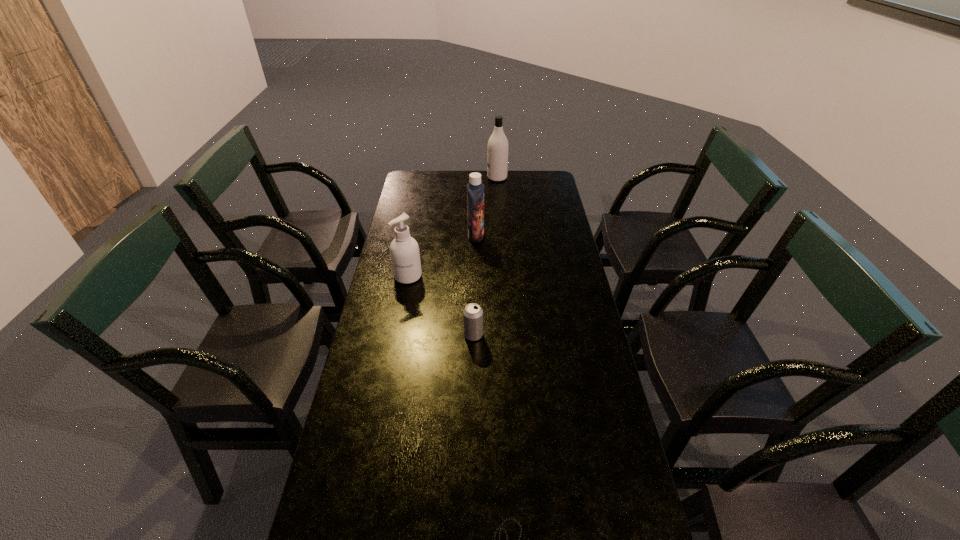
Identify the location of vacant space at the far right corner of the desktop. (530, 173).

Where is `vacant area that lies between the right shampoo and the fourth tallest object`? vacant area that lies between the right shampoo and the fourth tallest object is located at coordinates point(485,256).

Find the location of a particular element. This screenshot has width=960, height=540. vacant space in between the second farthest object and the cleansing agent is located at coordinates (442, 256).

Where is `unoccupied position between the farther shampoo and the beer can`? This screenshot has height=540, width=960. unoccupied position between the farther shampoo and the beer can is located at coordinates (485, 256).

Identify the location of vacant area that lies between the nearer shampoo and the farther shampoo. This screenshot has width=960, height=540. (487, 207).

You are a GUI agent. You are given a task and a screenshot of the screen. Output one action in this format:
    pyautogui.click(x=<x>, y=<y>)
    Task: Click on the vacant space that is in between the second shortest object and the nearer shampoo
    
    Given the screenshot: What is the action you would take?
    pyautogui.click(x=474, y=286)

Where is `empty space between the cleansing agent and the left shampoo`? Image resolution: width=960 pixels, height=540 pixels. empty space between the cleansing agent and the left shampoo is located at coordinates (442, 256).

Locate an element on the screen. This screenshot has width=960, height=540. object that stands as the fourth closest to the farthest object is located at coordinates (502, 523).

At what (x,y) coordinates should I click in order to perform the action: click on object that stands as the third closest to the farther shampoo. Please return your answer as a coordinate pair (x, y). Looking at the image, I should click on (472, 314).

Identify the location of vacant region that satisfies the following two spatial constraints: 1. on the front label of the beer can; 2. on the right side of the third nearest object. (396, 335).